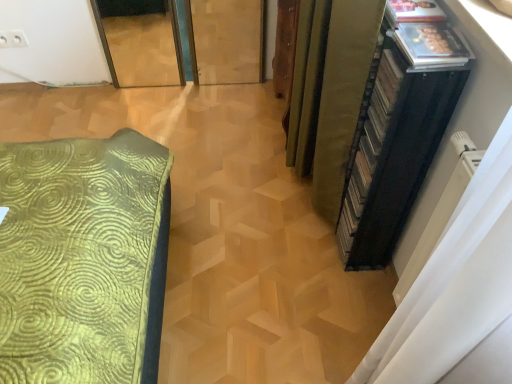
Question: Is there a large distance between white plastic electric outlet at upper left and green fabric curtain at right?

Choices:
 (A) no
 (B) yes

Answer: (B)

Question: From the image's perspective, would you say white plastic electric outlet at upper left is shown under green fabric curtain at right?

Choices:
 (A) no
 (B) yes

Answer: (A)

Question: Is white plastic electric outlet at upper left wider than green fabric curtain at right?

Choices:
 (A) no
 (B) yes

Answer: (A)

Question: Considering the relative sizes of white plastic electric outlet at upper left and green fabric curtain at right in the image provided, is white plastic electric outlet at upper left shorter than green fabric curtain at right?

Choices:
 (A) no
 (B) yes

Answer: (B)

Question: Can you confirm if white plastic electric outlet at upper left is smaller than green fabric curtain at right?

Choices:
 (A) no
 (B) yes

Answer: (B)

Question: Considering the relative sizes of white plastic electric outlet at upper left and green fabric curtain at right in the image provided, is white plastic electric outlet at upper left taller than green fabric curtain at right?

Choices:
 (A) yes
 (B) no

Answer: (B)

Question: From a real-world perspective, is green fabric curtain at right positioned under black plastic file cabinet at right based on gravity?

Choices:
 (A) yes
 (B) no

Answer: (A)

Question: Could you tell me if green fabric curtain at right is turned towards black plastic file cabinet at right?

Choices:
 (A) yes
 (B) no

Answer: (B)

Question: Is green fabric curtain at right facing away from black plastic file cabinet at right?

Choices:
 (A) yes
 (B) no

Answer: (B)

Question: Is green fabric curtain at right smaller than black plastic file cabinet at right?

Choices:
 (A) no
 (B) yes

Answer: (A)

Question: From a real-world perspective, is green fabric curtain at right located higher than black plastic file cabinet at right?

Choices:
 (A) yes
 (B) no

Answer: (B)

Question: Is green fabric curtain at right wider than black plastic file cabinet at right?

Choices:
 (A) no
 (B) yes

Answer: (B)

Question: Does black plastic file cabinet at right have a greater width compared to green fabric curtain at right?

Choices:
 (A) yes
 (B) no

Answer: (B)